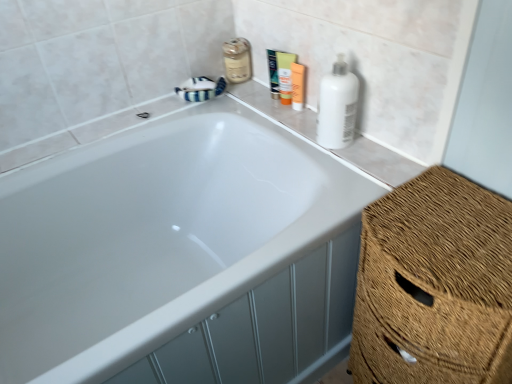
Identify the location of free spot above woven straw basket at right (from a real-world perspective). The image size is (512, 384). (452, 226).